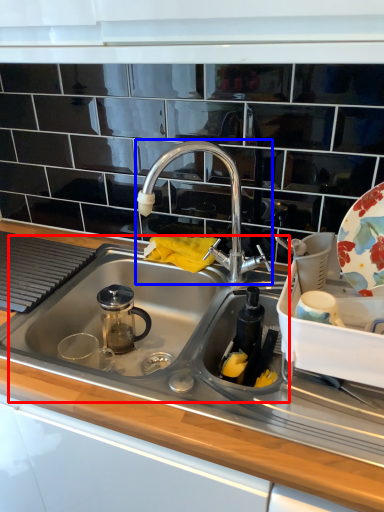
Question: Which of the following is the farthest to the observer, sink (highlighted by a red box) or tap (highlighted by a blue box)?

Choices:
 (A) sink
 (B) tap

Answer: (B)